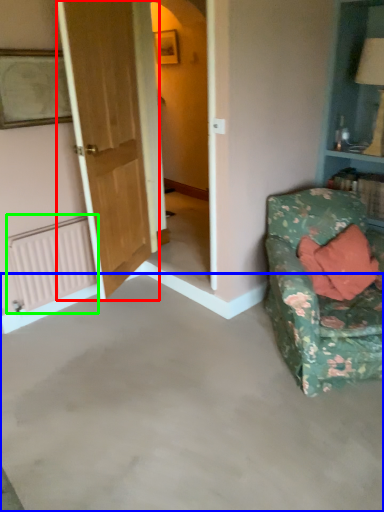
Question: Which object is the farthest from door (highlighted by a red box)? Choose among these: concrete (highlighted by a blue box) or radiator (highlighted by a green box).

Choices:
 (A) concrete
 (B) radiator

Answer: (A)